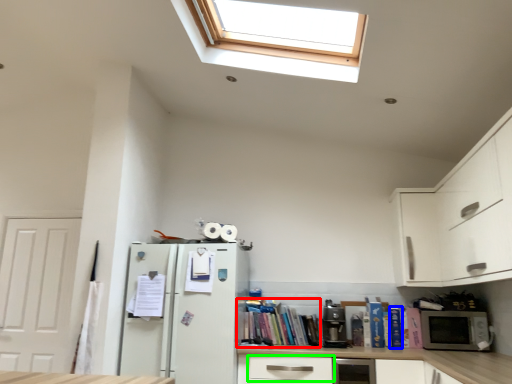
Question: Based on their relative distances, which object is farther from book (highlighted by a red box)? Choose from book (highlighted by a blue box) and drawer (highlighted by a green box).

Choices:
 (A) book
 (B) drawer

Answer: (A)